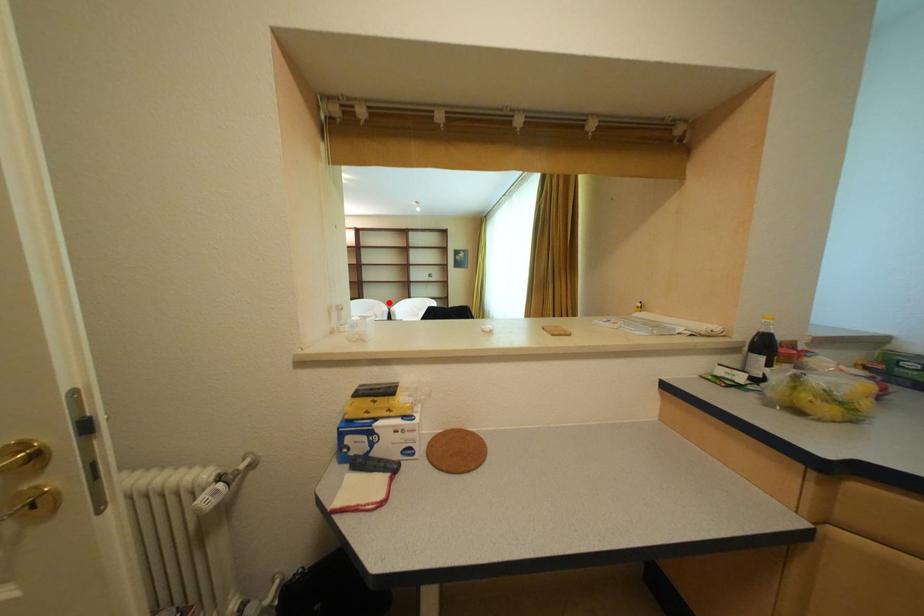
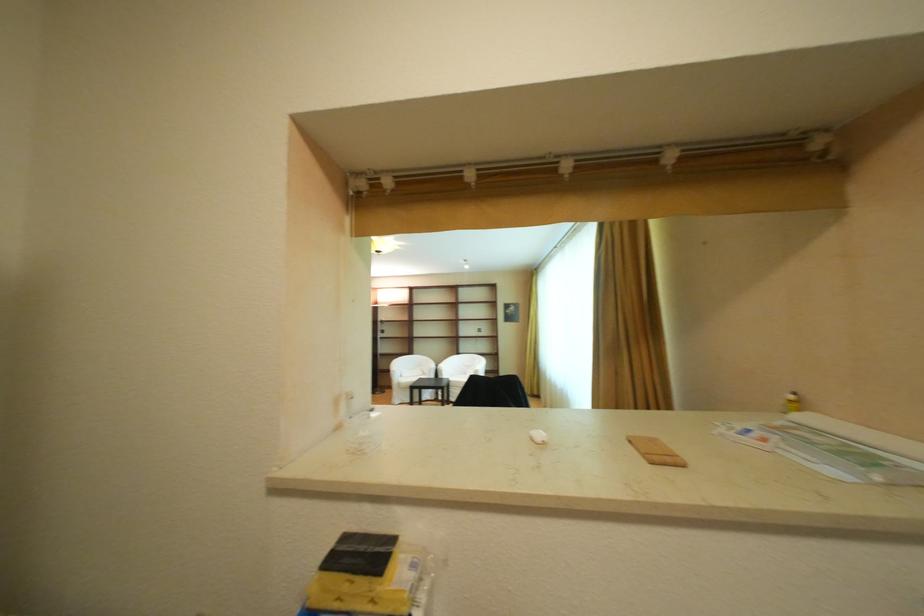
Question: A red point is marked in image1. In image2, is the corresponding 3D point closer to the camera or farther? Reply with the corresponding letter.

Choices:
 (A) The corresponding 3D point is closer.
 (B) The corresponding 3D point is farther.

Answer: (B)